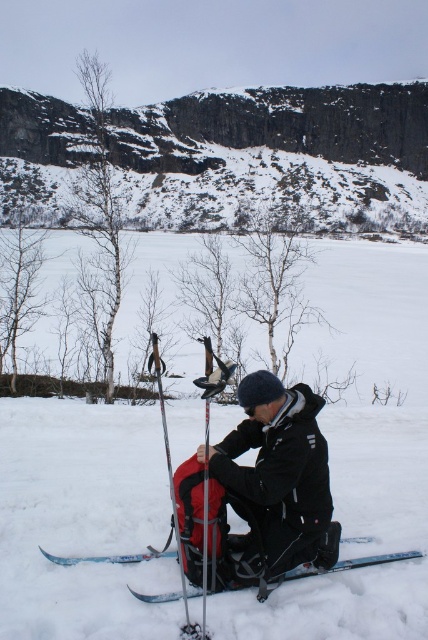
Question: Does blue metallic ski at center appear on the right side of matte black ski pole at center?

Choices:
 (A) yes
 (B) no

Answer: (A)

Question: Considering the relative positions of matte black backpack at center and blue metallic ski at center in the image provided, where is matte black backpack at center located with respect to blue metallic ski at center?

Choices:
 (A) below
 (B) above

Answer: (B)

Question: Which point is closer to the camera?

Choices:
 (A) blue metallic ski at center
 (B) white matte snow at center

Answer: (B)

Question: Among these points, which one is nearest to the camera?

Choices:
 (A) (238, 618)
 (B) (336, 568)
 (C) (353, 538)

Answer: (A)

Question: Observing the image, what is the correct spatial positioning of matte black backpack at center in reference to blue metallic ski at center?

Choices:
 (A) left
 (B) right

Answer: (A)

Question: Among these objects, which one is nearest to the camera?

Choices:
 (A) matte black backpack at center
 (B) matte black ski pole at center

Answer: (B)